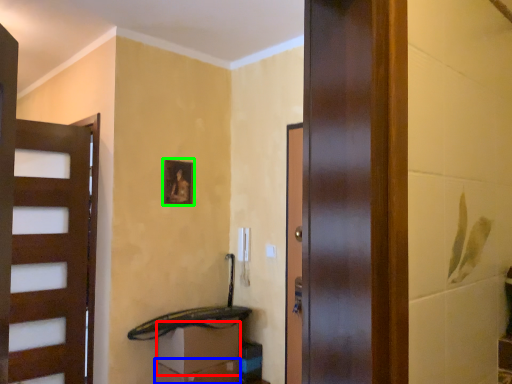
Question: Estimate the real-world distances between objects in this image. Which object is farther from drawer (highlighted by a red box), drawer (highlighted by a blue box) or picture frame (highlighted by a green box)?

Choices:
 (A) drawer
 (B) picture frame

Answer: (B)